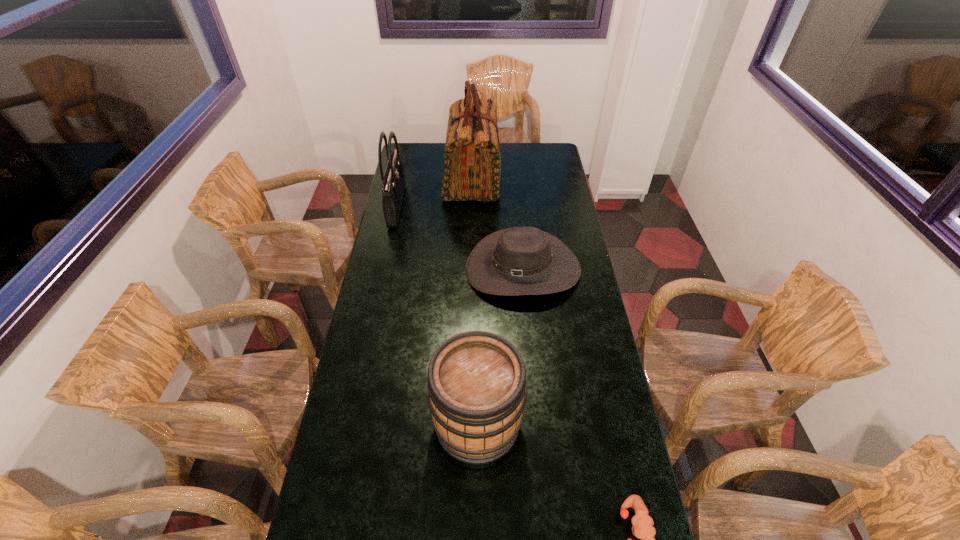
This screenshot has height=540, width=960. I want to click on free space located 0.080m on the front-facing side of the cowboy hat, so click(x=528, y=323).

This screenshot has width=960, height=540. I want to click on object that is positioned at the far edge, so click(472, 164).

This screenshot has width=960, height=540. Identify the location of object that is at the left edge. (393, 182).

Image resolution: width=960 pixels, height=540 pixels. Find the location of `object situated at the right edge`. object situated at the right edge is located at coordinates (516, 261).

In order to click on vacant space at the left edge of the desktop in this screenshot , I will do `click(413, 170)`.

In the image, there is a desktop. Identify the location of blank space at the right edge. Image resolution: width=960 pixels, height=540 pixels. (632, 465).

This screenshot has width=960, height=540. Find the location of `vacant area at the far left corner`. vacant area at the far left corner is located at coordinates (412, 150).

The height and width of the screenshot is (540, 960). I want to click on blank region between the second nearest object and the shopping bag, so click(x=475, y=301).

I want to click on unoccupied area between the second shortest object and the second tallest object, so click(x=460, y=237).

Where is `object that stands as the second closest to the leftmost object`? This screenshot has height=540, width=960. object that stands as the second closest to the leftmost object is located at coordinates (516, 261).